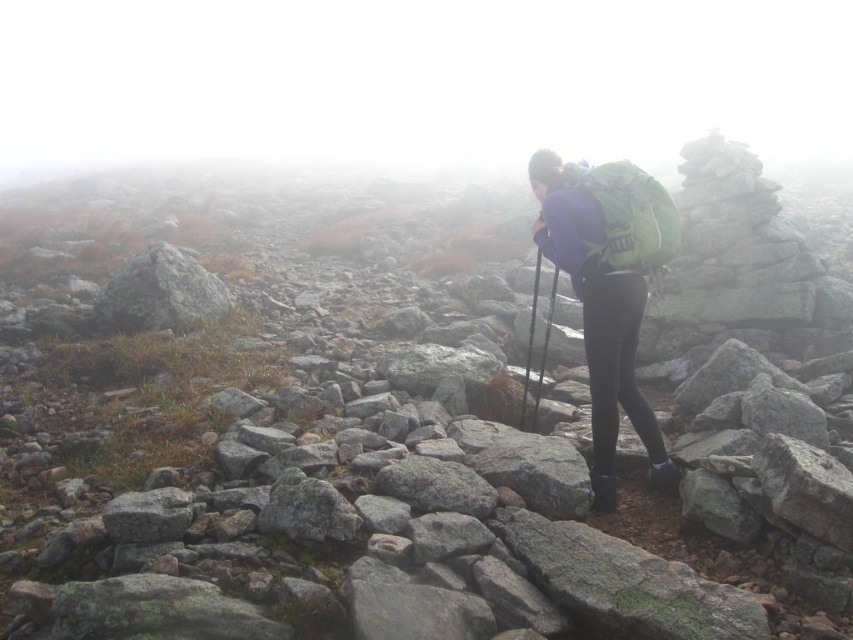
You are a hiker planning to place a small marker at the point marked as point (608, 289). Given the scene description, what object will the marker be placed on top of?

The marker will be placed on top of the matte purple jacket at center, as the point (608, 289) corresponds to it according to the description.

You are a hiker trying to navigate the rocky terrain. You see the matte purple jacket at center and the gray rough rock at left. Which object is located to the right of the other?

The matte purple jacket at center is positioned on the right side of gray rough rock at left.

You are the hiker in the misty rocky terrain. You notice two points marked on your map. The first is at point (590, 200) and the second at point (177, 314). Which point is closer to your current position?

Point (590, 200) is closer to the viewer than point (177, 314), so the first point is closer to your current position.